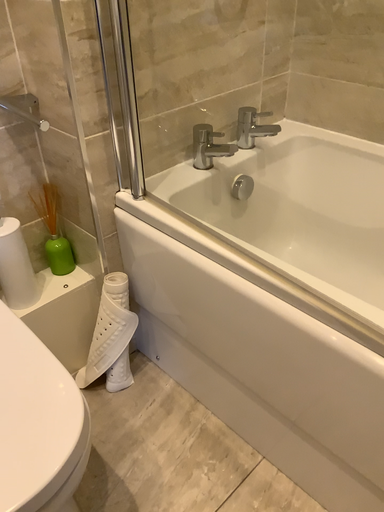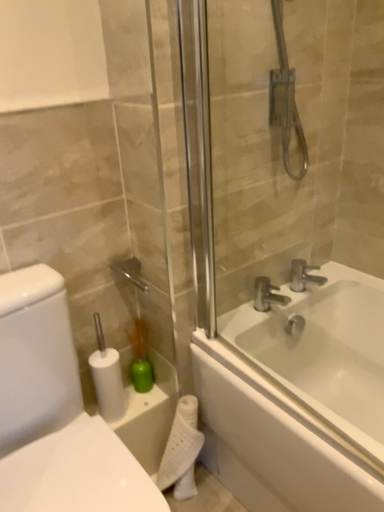
Question: Which way did the camera rotate in the video?

Choices:
 (A) rotated upward
 (B) rotated downward

Answer: (A)